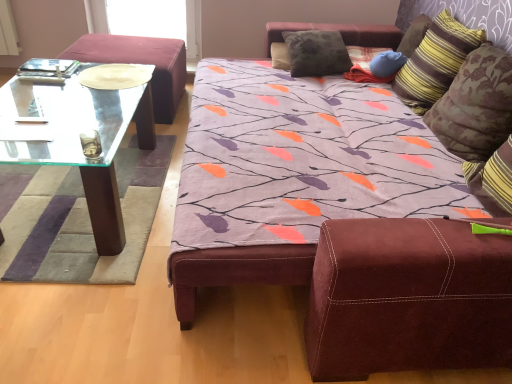
Question: Is the position of blue fabric pillow at upper right, which is counted as the second pillow, starting from the left, less distant than that of striped fabric pillow at upper right, marked as the second pillow in a right-to-left arrangement?

Choices:
 (A) no
 (B) yes

Answer: (A)

Question: Is the depth of blue fabric pillow at upper right, which is counted as the second pillow, starting from the left, greater than that of striped fabric pillow at upper right, marked as the second pillow in a right-to-left arrangement?

Choices:
 (A) no
 (B) yes

Answer: (B)

Question: Does blue fabric pillow at upper right, which is counted as the second pillow, starting from the left, have a greater height compared to striped fabric pillow at upper right, which is the 3th pillow from left to right?

Choices:
 (A) no
 (B) yes

Answer: (A)

Question: Is blue fabric pillow at upper right, which is counted as the second pillow, starting from the left, thinner than striped fabric pillow at upper right, marked as the second pillow in a right-to-left arrangement?

Choices:
 (A) no
 (B) yes

Answer: (B)

Question: Does blue fabric pillow at upper right, which appears as the 3th pillow when viewed from the right, have a greater width compared to striped fabric pillow at upper right, which is the 3th pillow from left to right?

Choices:
 (A) no
 (B) yes

Answer: (A)

Question: Considering their positions, is striped fabric pillow at upper right, marked as the second pillow in a right-to-left arrangement, located in front of or behind velvety gray pillow at upper center, positioned as the first pillow in left-to-right order?

Choices:
 (A) front
 (B) behind

Answer: (A)

Question: From a real-world perspective, is striped fabric pillow at upper right, which is the 3th pillow from left to right, above or below velvety gray pillow at upper center, positioned as the first pillow in left-to-right order?

Choices:
 (A) above
 (B) below

Answer: (A)

Question: Is striped fabric pillow at upper right, marked as the second pillow in a right-to-left arrangement, wider or thinner than velvety gray pillow at upper center, positioned as the first pillow in left-to-right order?

Choices:
 (A) wide
 (B) thin

Answer: (B)

Question: From their relative heights in the image, would you say striped fabric pillow at upper right, which is the 3th pillow from left to right, is taller or shorter than velvety gray pillow at upper center, positioned as the first pillow in left-to-right order?

Choices:
 (A) short
 (B) tall

Answer: (B)

Question: Is velvet burgundy ottoman at left taller or shorter than velvety gray pillow at upper center, positioned as the 4th pillow in right-to-left order?

Choices:
 (A) short
 (B) tall

Answer: (B)

Question: Does point (159, 61) appear closer or farther from the camera than point (330, 46)?

Choices:
 (A) farther
 (B) closer

Answer: (A)

Question: From a real-world perspective, relative to velvety gray pillow at upper center, positioned as the 4th pillow in right-to-left order, is velvet burgundy ottoman at left vertically above or below?

Choices:
 (A) above
 (B) below

Answer: (B)

Question: Looking at the image, does velvet burgundy ottoman at left seem bigger or smaller compared to velvety gray pillow at upper center, positioned as the 4th pillow in right-to-left order?

Choices:
 (A) small
 (B) big

Answer: (B)

Question: Would you say striped fabric pillow at upper right, placed as the fourth pillow when sorted from left to right, is inside or outside transparent glass coffee table at left?

Choices:
 (A) inside
 (B) outside

Answer: (B)

Question: In terms of width, does striped fabric pillow at upper right, placed as the fourth pillow when sorted from left to right, look wider or thinner when compared to transparent glass coffee table at left?

Choices:
 (A) thin
 (B) wide

Answer: (A)